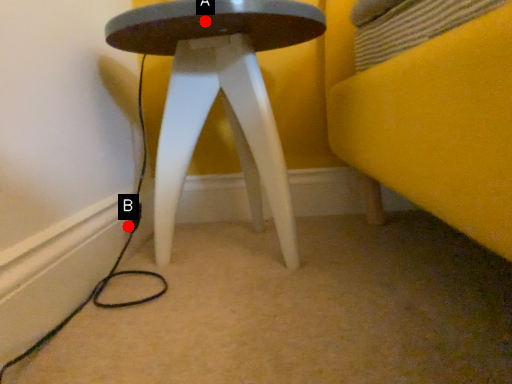
Question: Two points are circled on the image, labeled by A and B beside each circle. Which point is further to the camera?

Choices:
 (A) A is further
 (B) B is further

Answer: (B)